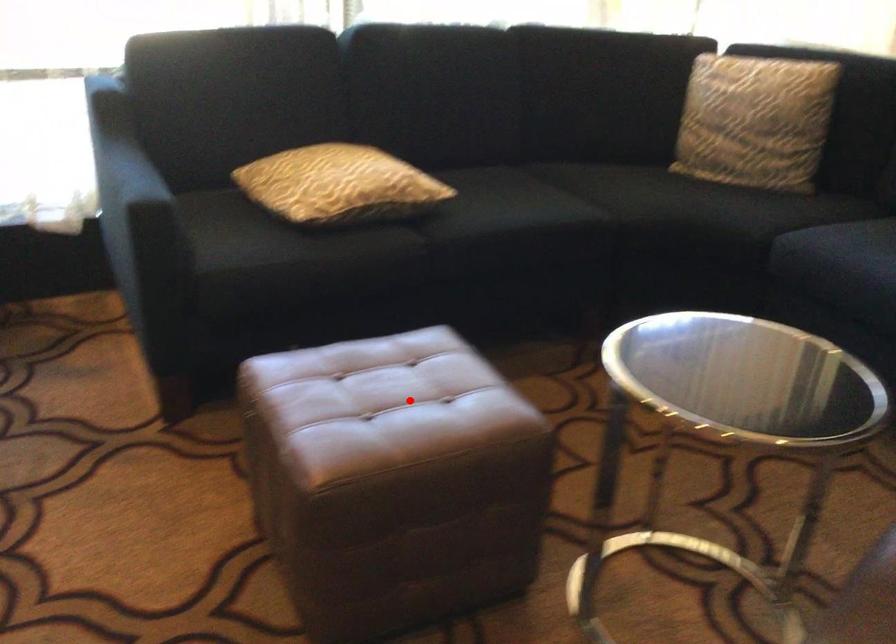
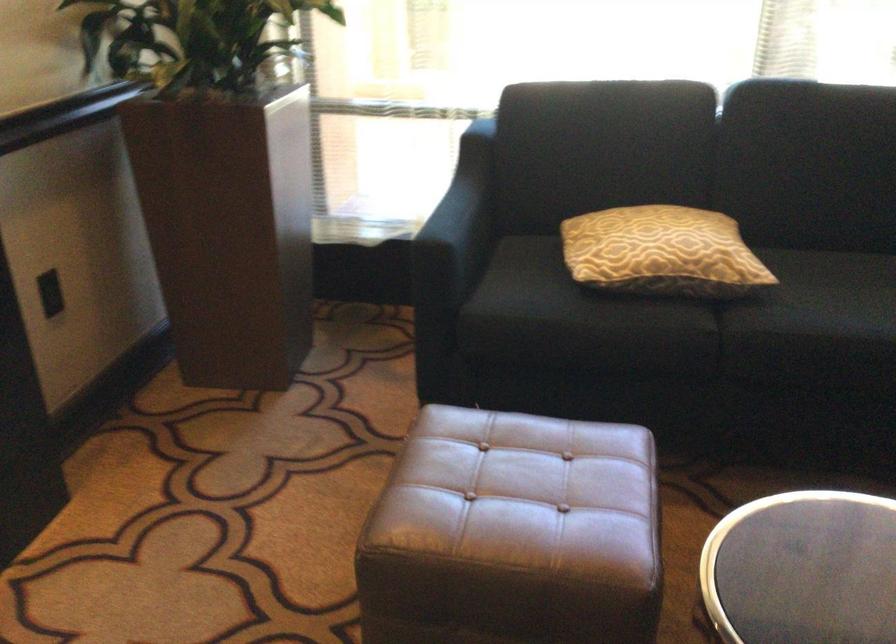
In the second image, find the point that corresponds to the highlighted location in the first image.

(522, 495)